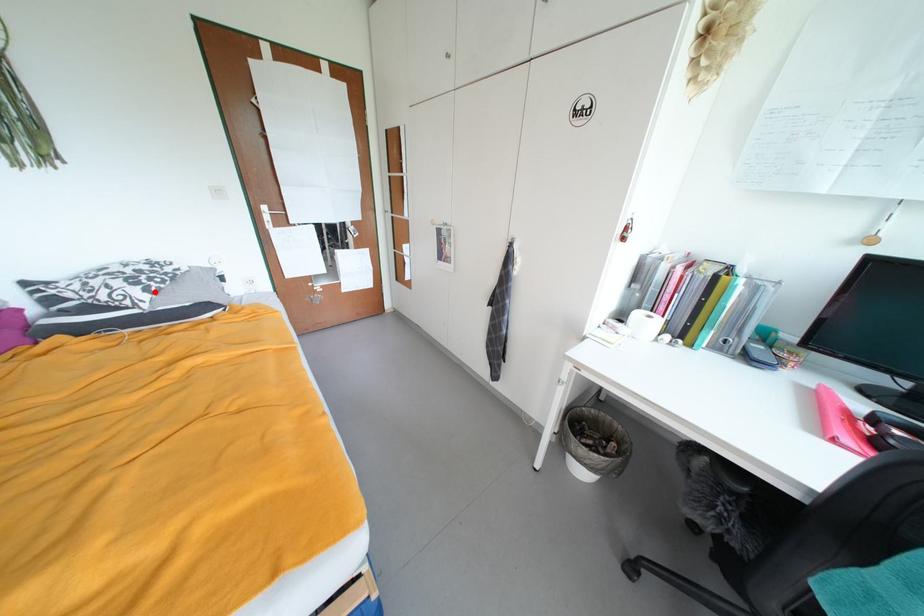
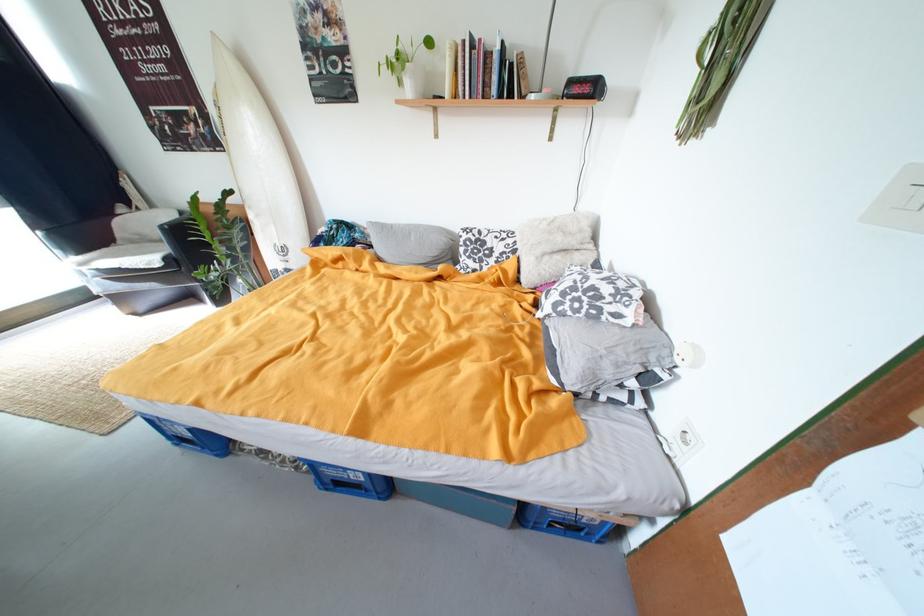
Question: I am providing you with two images of the same scene from different viewpoints. In image1, a red point is highlighted. Considering the same 3D point in image2, which of the following is correct?

Choices:
 (A) It is closer
 (B) It is farther

Answer: (A)